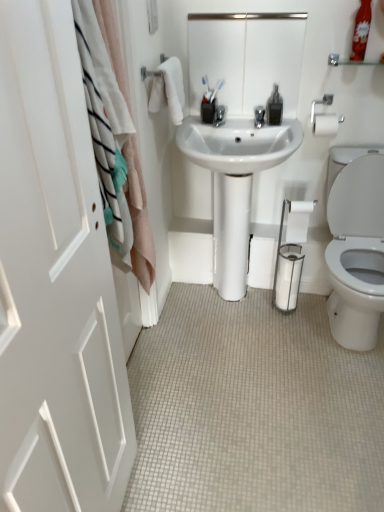
Question: Is white glossy mirror at upper center facing away from white matte door at left?

Choices:
 (A) yes
 (B) no

Answer: (B)

Question: Can you confirm if white glossy mirror at upper center is bigger than white matte door at left?

Choices:
 (A) no
 (B) yes

Answer: (A)

Question: Can you confirm if white glossy mirror at upper center is smaller than white matte door at left?

Choices:
 (A) no
 (B) yes

Answer: (B)

Question: From a real-world perspective, is white glossy mirror at upper center below white matte door at left?

Choices:
 (A) no
 (B) yes

Answer: (A)

Question: Considering the relative positions of white glossy mirror at upper center and white matte door at left in the image provided, is white glossy mirror at upper center to the left of white matte door at left from the viewer's perspective?

Choices:
 (A) no
 (B) yes

Answer: (A)

Question: From the image's perspective, relative to white tile floor at lower center, is clear plastic bottle at upper right above or below?

Choices:
 (A) below
 (B) above

Answer: (B)

Question: In terms of height, does clear plastic bottle at upper right look taller or shorter compared to white tile floor at lower center?

Choices:
 (A) tall
 (B) short

Answer: (A)

Question: Would you say clear plastic bottle at upper right is to the left or to the right of white tile floor at lower center in the picture?

Choices:
 (A) left
 (B) right

Answer: (B)

Question: Is clear plastic bottle at upper right in front of or behind white tile floor at lower center in the image?

Choices:
 (A) behind
 (B) front

Answer: (A)

Question: Is clear glass shelf at upper right bigger or smaller than white tile floor at lower center?

Choices:
 (A) small
 (B) big

Answer: (A)

Question: From the image's perspective, relative to white tile floor at lower center, is clear glass shelf at upper right above or below?

Choices:
 (A) below
 (B) above

Answer: (B)

Question: From a real-world perspective, relative to white tile floor at lower center, is clear glass shelf at upper right vertically above or below?

Choices:
 (A) below
 (B) above

Answer: (B)

Question: Relative to white tile floor at lower center, is clear glass shelf at upper right in front or behind?

Choices:
 (A) front
 (B) behind

Answer: (B)

Question: Considering the positions of white soft towel at upper left and white fabric curtain at left in the image, is white soft towel at upper left bigger or smaller than white fabric curtain at left?

Choices:
 (A) small
 (B) big

Answer: (B)

Question: From the image's perspective, is white soft towel at upper left positioned above or below white fabric curtain at left?

Choices:
 (A) below
 (B) above

Answer: (B)